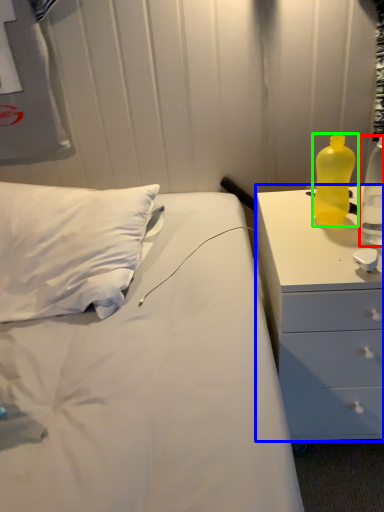
Question: Which object is positioned farthest from bottle (highlighted by a red box)? Select from chest of drawers (highlighted by a blue box) and bottle (highlighted by a green box).

Choices:
 (A) chest of drawers
 (B) bottle

Answer: (A)